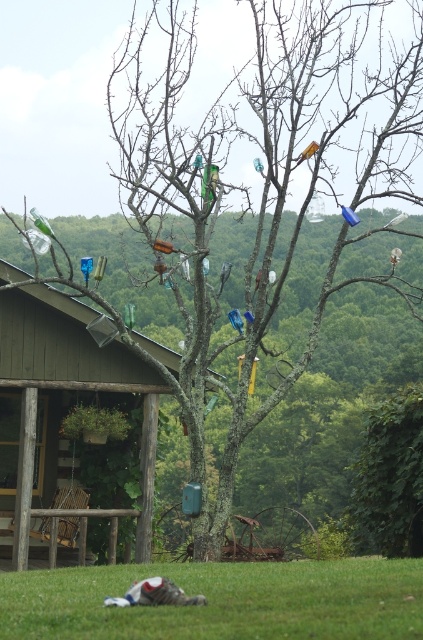
Question: Is green grass at lower center positioned at the back of wooden porch swing at left?

Choices:
 (A) no
 (B) yes

Answer: (A)

Question: Which of the following is the farthest from the observer?

Choices:
 (A) (381, 618)
 (B) (126, 508)

Answer: (B)

Question: Where is green grass at lower center located in relation to wooden porch swing at left in the image?

Choices:
 (A) left
 (B) right

Answer: (B)

Question: Which object appears farthest from the camera in this image?

Choices:
 (A) green grass at lower center
 (B) wooden porch swing at left

Answer: (B)

Question: Is green grass at lower center to the right of wooden porch swing at left from the viewer's perspective?

Choices:
 (A) yes
 (B) no

Answer: (A)